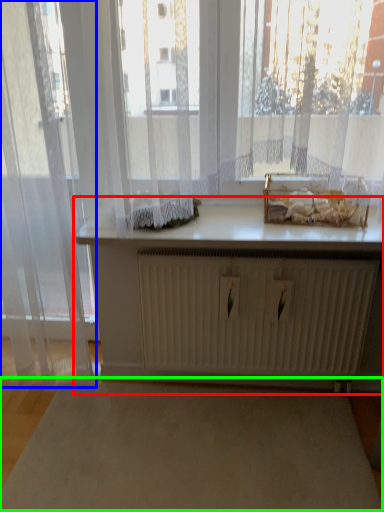
Question: Considering the real-world distances, which object is closest to table (highlighted by a red box)? curtain (highlighted by a blue box) or plain (highlighted by a green box).

Choices:
 (A) curtain
 (B) plain

Answer: (B)